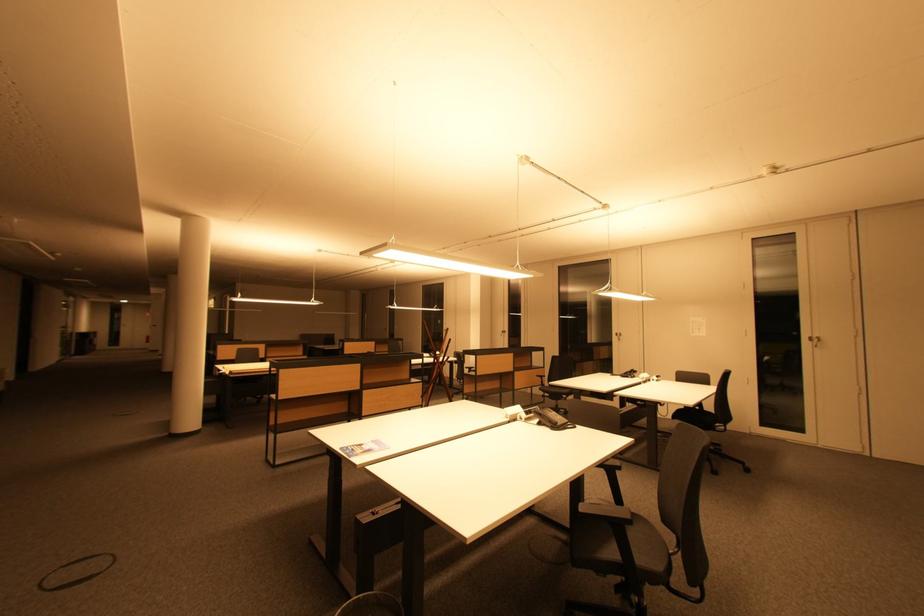
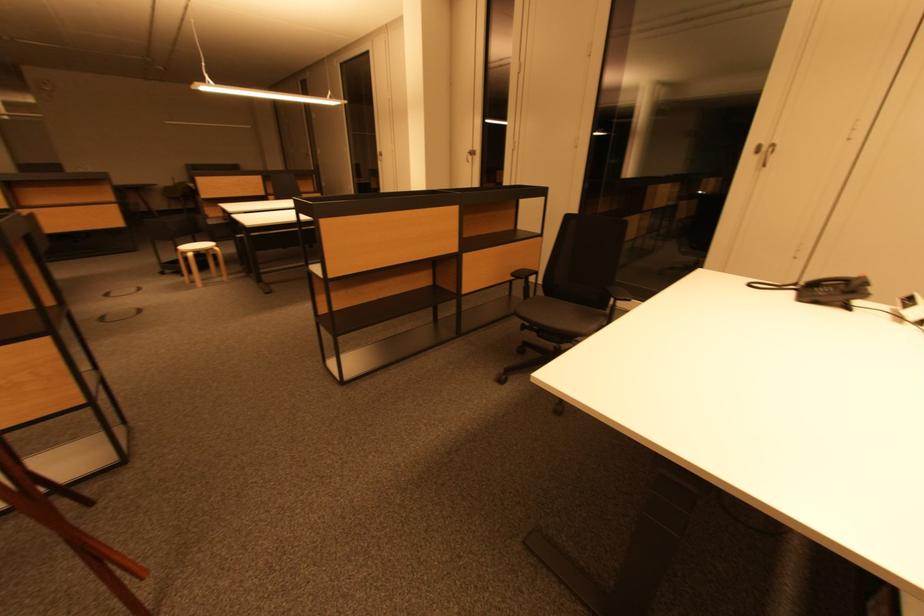
In the second image, find the point that corresponds to point 623,336 in the first image.

(767, 150)